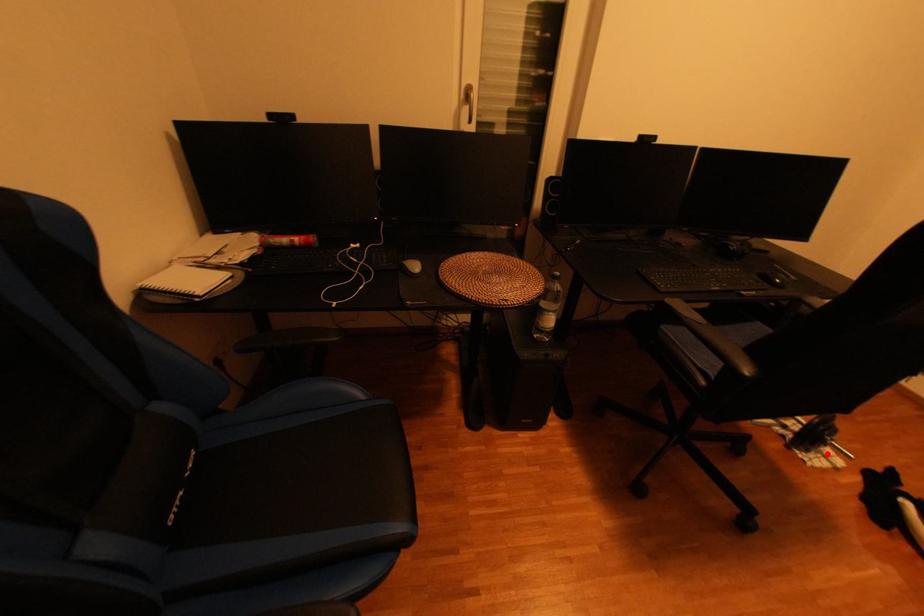
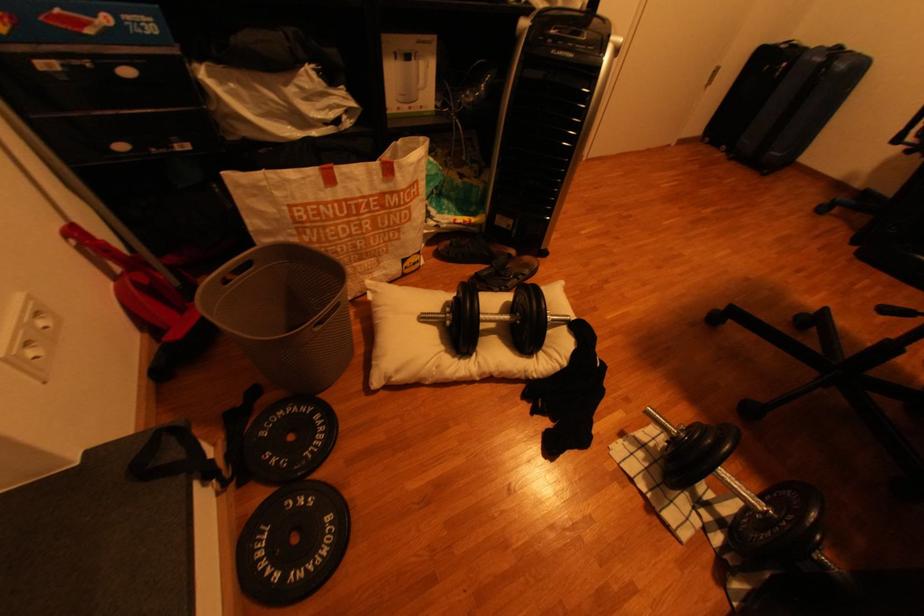
The point at the highlighted location is marked in the first image. Where is the corresponding point in the second image?

(665, 446)